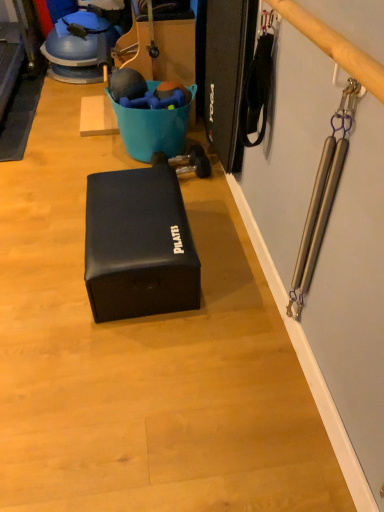
Locate an element on the screen. free point above dark blue rubber yoga mat at left (from a real-world perspective) is located at coordinates (29, 106).